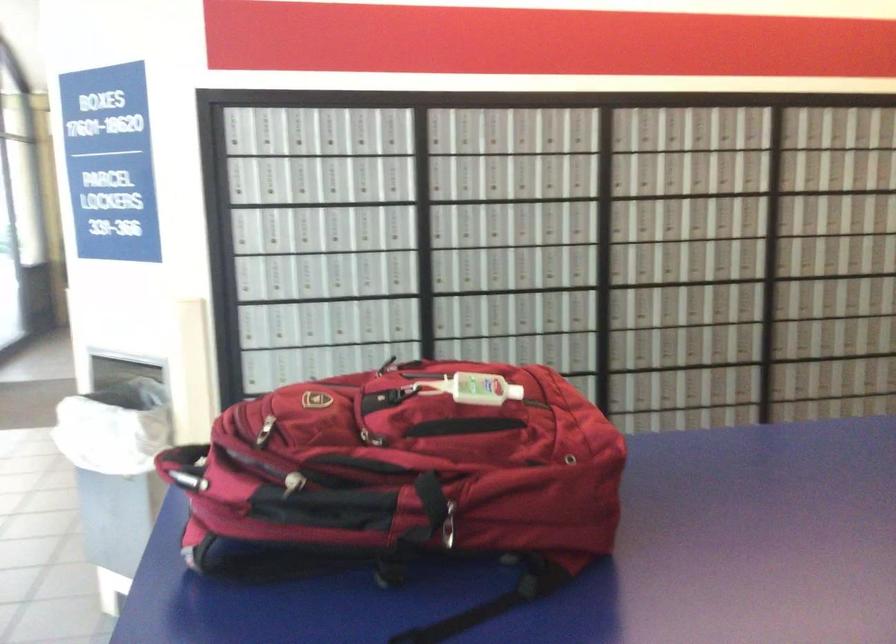
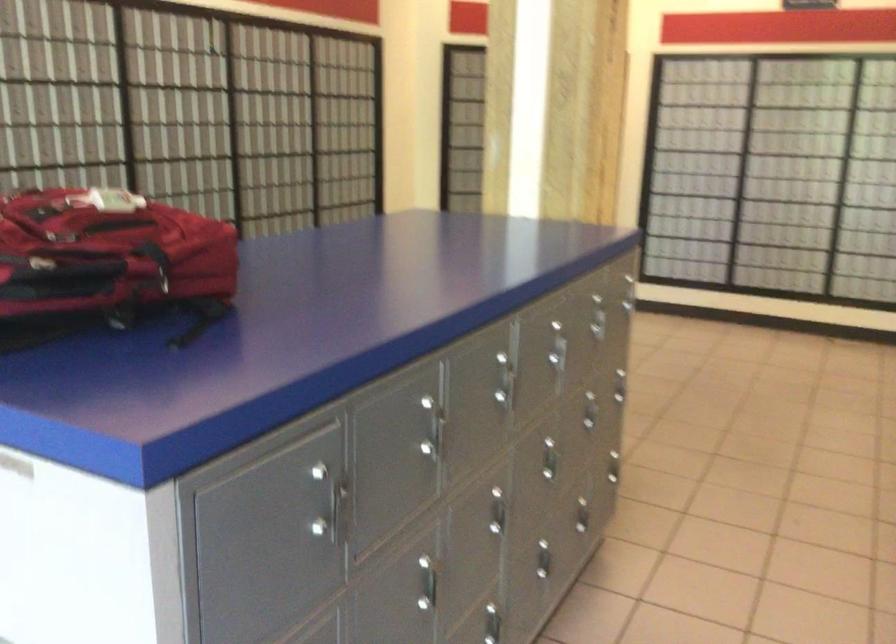
Find the pixel in the second image that matches point (421, 511) in the first image.

(156, 263)